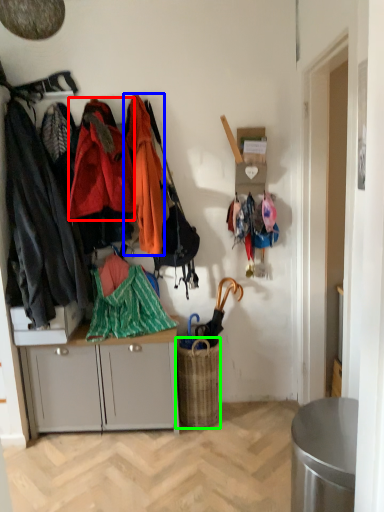
Question: Which object is the farthest from clothing (highlighted by a red box)? Choose among these: clothing (highlighted by a blue box) or picnic basket (highlighted by a green box).

Choices:
 (A) clothing
 (B) picnic basket

Answer: (B)